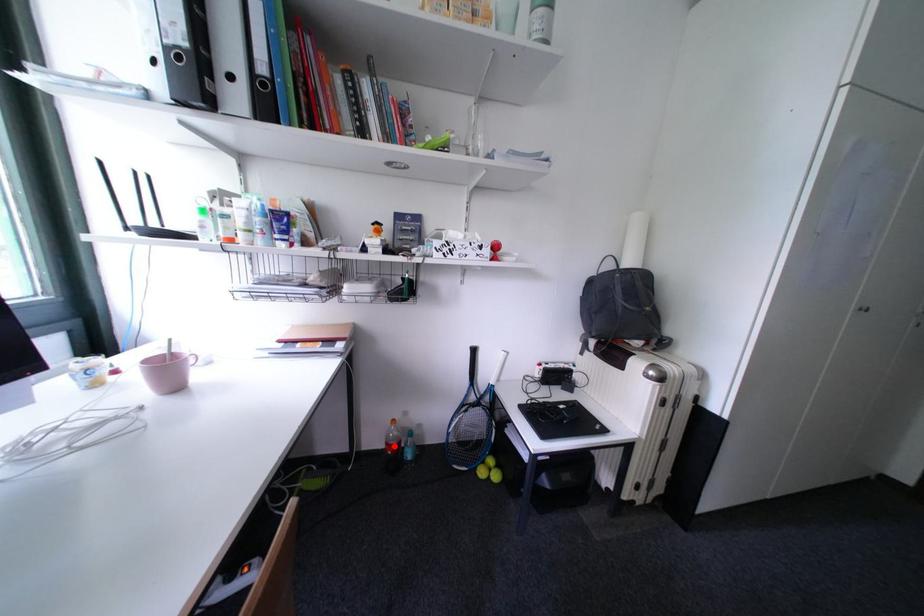
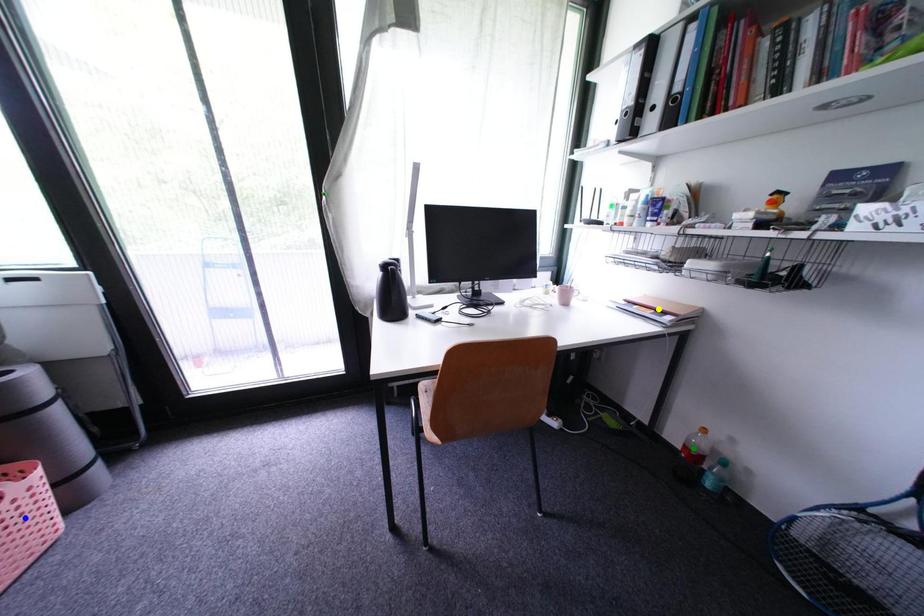
Question: I am providing you with two images of the same scene from different viewpoints. A red point is marked on the first image. You are given multiple points on the second image. Which mark in image 2 goes with the point in image 1?

Choices:
 (A) blue point
 (B) green point
 (C) yellow point

Answer: (B)